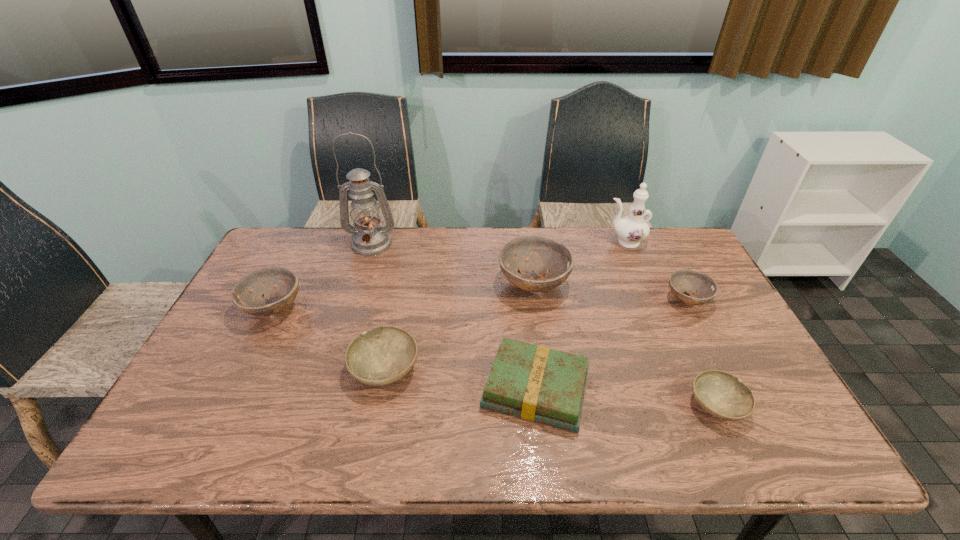
Locate an element on the screen. yellow book is located at coordinates (535, 383).

You are a GUI agent. You are given a task and a screenshot of the screen. Output one action in this format:
    pyautogui.click(x=<x>, y=<y>)
    Task: Click on the smaller gray bowl
    Image resolution: width=960 pixels, height=540 pixels.
    Given the screenshot: What is the action you would take?
    pyautogui.click(x=721, y=394)

At what (x,y) coordinates should I click in order to perform the action: click on the shortest object. Please return your answer as a coordinate pair (x, y). The width and height of the screenshot is (960, 540). Looking at the image, I should click on (721, 394).

Where is `vacant space located 0.240m on the left of the oil lamp`? vacant space located 0.240m on the left of the oil lamp is located at coordinates (277, 244).

This screenshot has height=540, width=960. Identify the location of free space located at the spout of the chinaware. (564, 242).

Find the location of a particular element. The width and height of the screenshot is (960, 540). vacant space situated 0.100m at the spout of the chinaware is located at coordinates (575, 242).

Find the location of `free location located at the spout of the chinaware`. free location located at the spout of the chinaware is located at coordinates (552, 242).

You are a GUI agent. You are given a task and a screenshot of the screen. Output one action in this format:
    pyautogui.click(x=<x>, y=<y>)
    Task: Click on the free region located 0.050m on the left of the second brown bowl from left to right
    This screenshot has width=960, height=540.
    Given the screenshot: What is the action you would take?
    pyautogui.click(x=482, y=284)

The image size is (960, 540). Identify the location of free space located on the back of the leftmost brown bowl. (296, 263).

What are the coordinates of `free space located 0.370m on the left of the second bowl from left to right` in the screenshot? It's located at (205, 369).